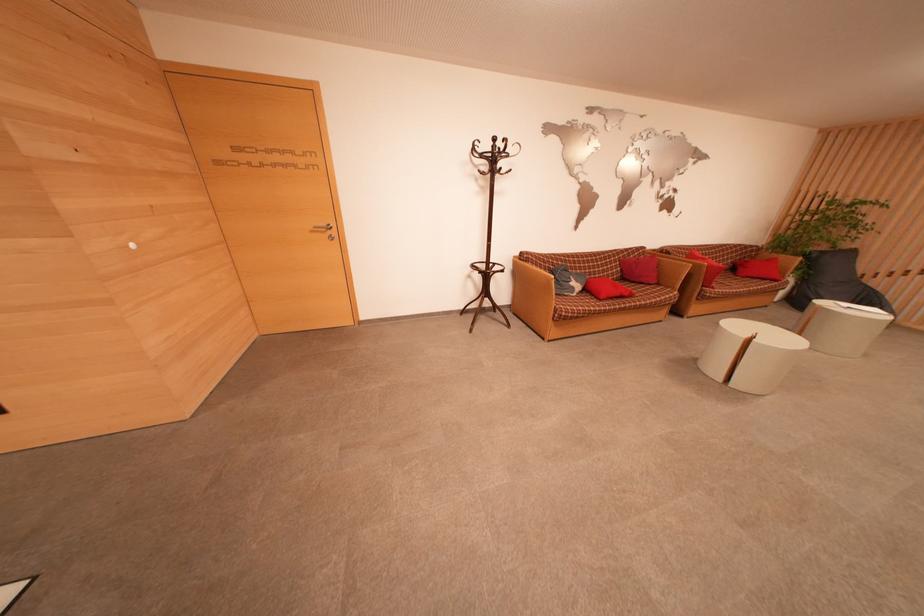
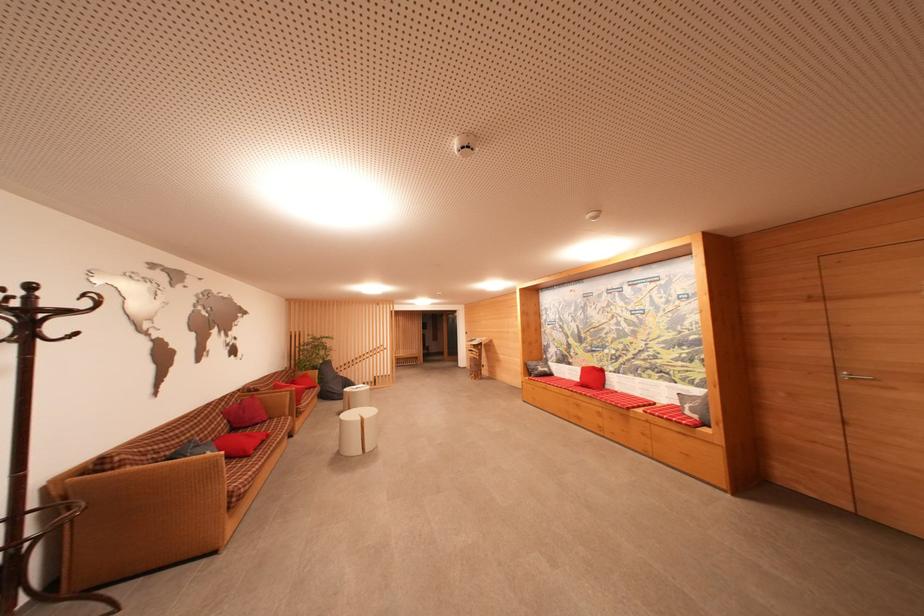
Question: I am providing you with two images of the same scene from different viewpoints. Which of the following objects are not visible in image2?

Choices:
 (A) coat rack hook
 (B) red pillow
 (C) grey pillow
 (D) none of these

Answer: (D)